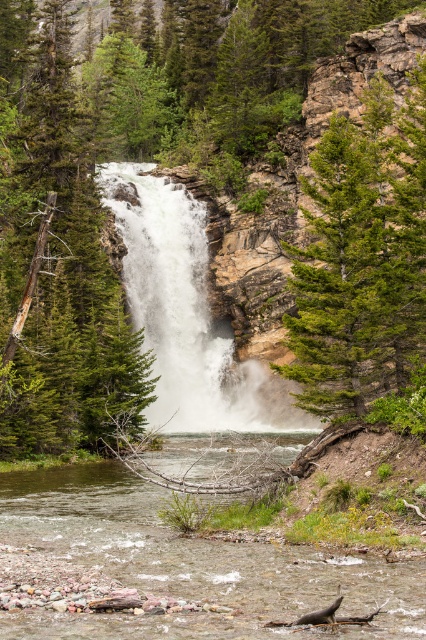
Question: Considering the real-world distances, which object is farthest from the green matte tree at left?

Choices:
 (A) brown gravel river at lower center
 (B) green rough bark tree at upper center
 (C) white frothy water at center

Answer: (A)

Question: Is green matte tree at left further to the viewer compared to white frothy water at center?

Choices:
 (A) no
 (B) yes

Answer: (A)

Question: Does brown gravel river at lower center appear under green rough bark tree at upper center?

Choices:
 (A) yes
 (B) no

Answer: (A)

Question: Among these objects, which one is nearest to the camera?

Choices:
 (A) brown gravel river at lower center
 (B) green matte tree at left

Answer: (A)

Question: Does green matte tree at left appear over white frothy water at center?

Choices:
 (A) no
 (B) yes

Answer: (B)

Question: Among these points, which one is farthest from the camera?

Choices:
 (A) (402, 364)
 (B) (316, 634)

Answer: (A)